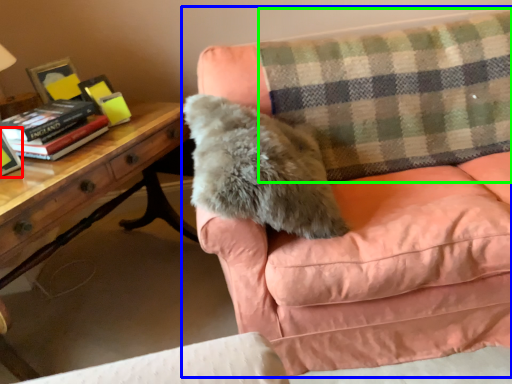
Question: Considering the real-world distances, which object is farthest from paperback book (highlighted by a red box)? studio couch (highlighted by a blue box) or plaid (highlighted by a green box)?

Choices:
 (A) studio couch
 (B) plaid

Answer: (B)